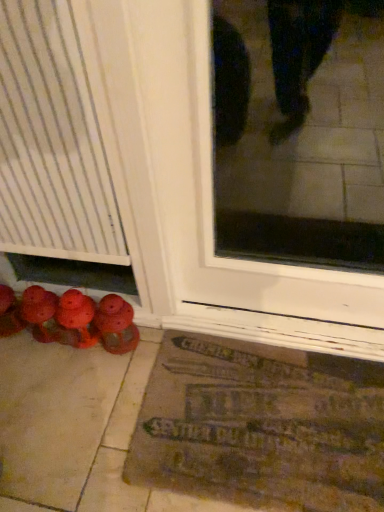
The height and width of the screenshot is (512, 384). What are the coordinates of `vacant area that is situated to the right of matte red shoes at lower left, positioned as the first footwear in right-to-left order` in the screenshot? It's located at (155, 342).